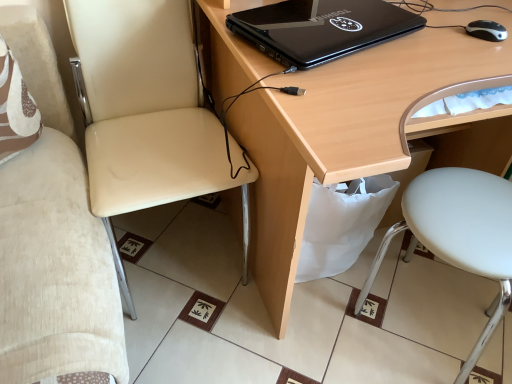
Image resolution: width=512 pixels, height=384 pixels. I want to click on vacant space situated on the left part of white matte stool at lower right, the 1th chair from the right, so click(x=314, y=340).